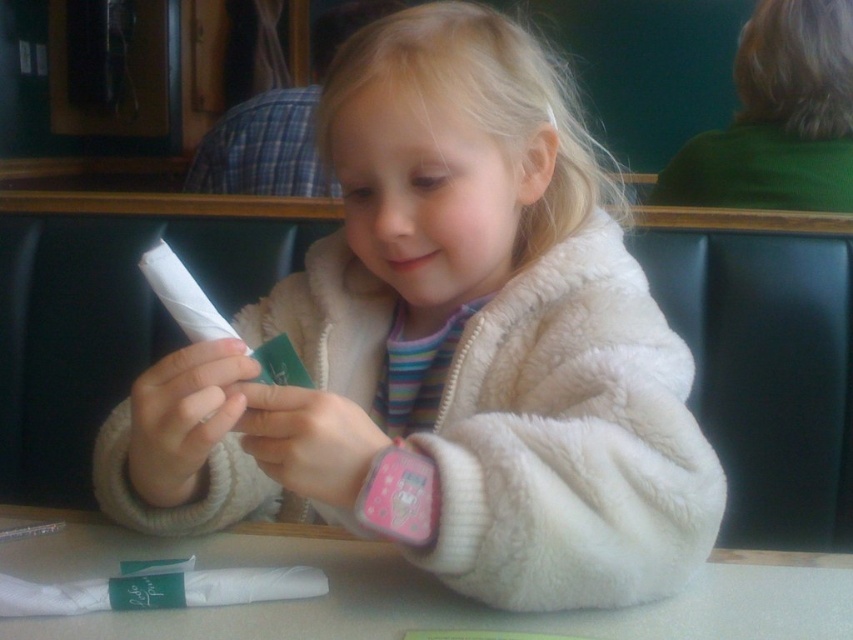
You are a photographer trying to capture the girl and her items. Since the white fluffy coat at center and the white matte table at center are both white, will the coat block the table from view in the photo?

The white fluffy coat at center is in front of the white matte table at center, so it will block part of the table from view in the photo.

You are a fashion designer who wants to place a new accessory on the table. The accessory is the same size as the white fluffy coat at center. Based on the scene, will the accessory fit on the white matte table at center?

The white fluffy coat at center is larger in size than the white matte table at center. Since the accessory is the same size as the coat, it will not fit on the white matte table at center.

You are a photographer trying to capture the girl in the scene. You want to ensure that both the white fluffy coat at center and the white matte table at center are visible in your shot. Based on their positions, which object should you place closer to the left side of the frame to achieve this?

The white fluffy coat at center is positioned on the right side of the white matte table at center. To include both in the frame, you should position the white matte table at center closer to the left side so that the white fluffy coat at center naturally falls to the right, ensuring both are visible.